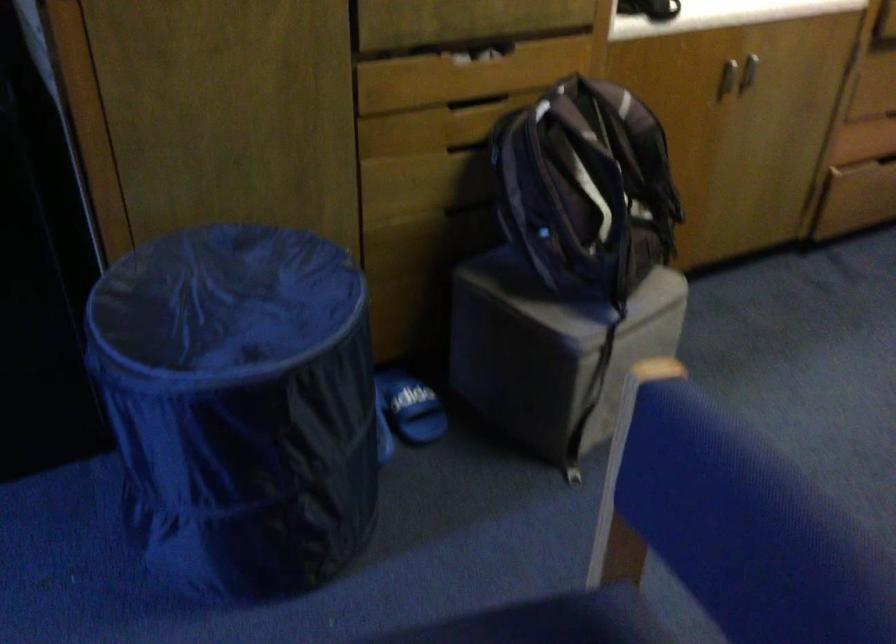
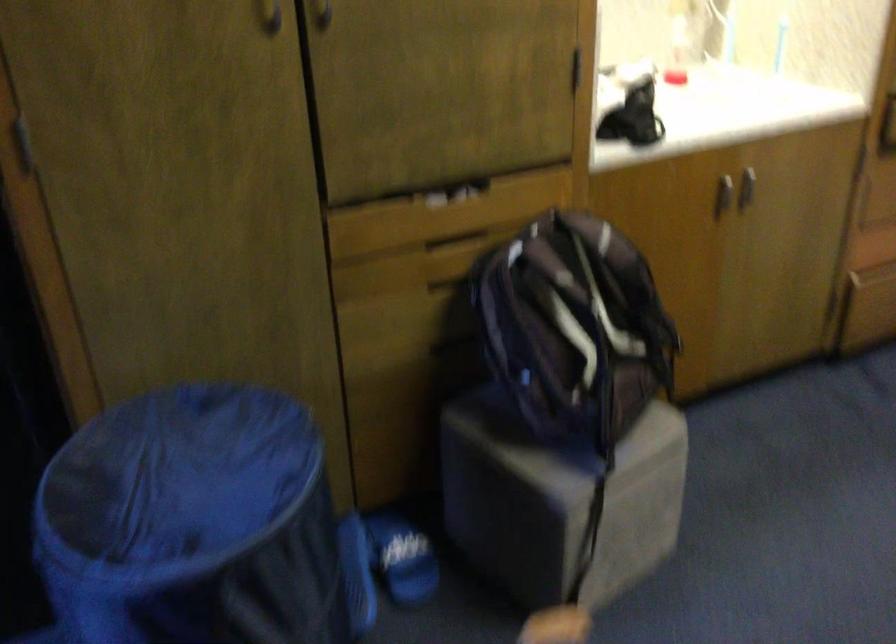
Question: How did the camera likely rotate?

Choices:
 (A) Left
 (B) Right
 (C) Up
 (D) Down

Answer: (C)